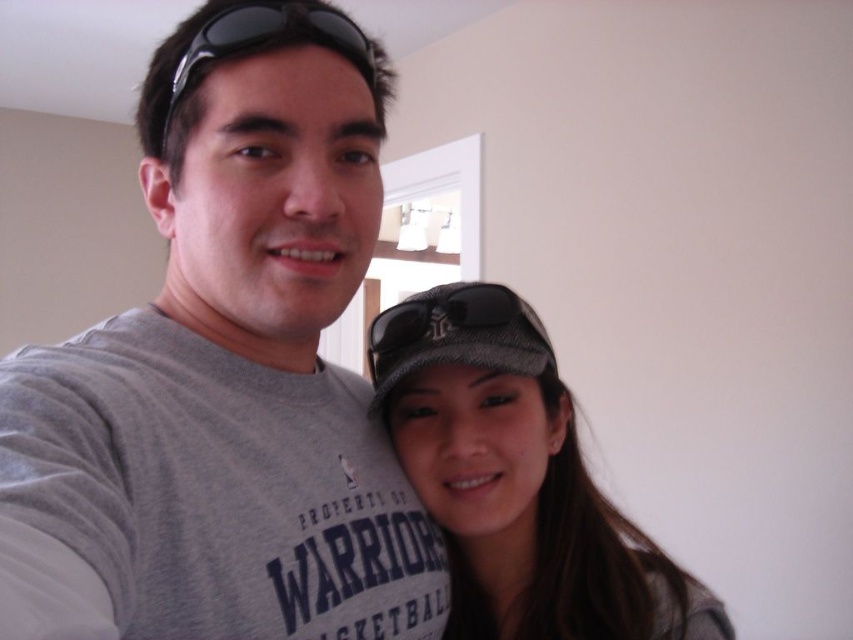
Can you confirm if gray mesh baseball cap at lower right is wider than black plastic sunglasses at upper center?

Yes, gray mesh baseball cap at lower right is wider than black plastic sunglasses at upper center.

Which is in front, point (390, 310) or point (364, 64)?

Positioned in front is point (364, 64).

Where is `gray mesh baseball cap at lower right`? gray mesh baseball cap at lower right is located at coordinates (456, 333).

Does gray matte t-shirt at center come behind gray mesh baseball cap at lower right?

No.

Is gray matte t-shirt at center below gray mesh baseball cap at lower right?

Incorrect, gray matte t-shirt at center is not positioned below gray mesh baseball cap at lower right.

The image size is (853, 640). Find the location of `gray matte t-shirt at center`. gray matte t-shirt at center is located at coordinates (225, 376).

Where is `gray matte t-shirt at center`? gray matte t-shirt at center is located at coordinates (225, 376).

Does gray matte t-shirt at center appear on the right side of textured gray cap at center?

Incorrect, gray matte t-shirt at center is not on the right side of textured gray cap at center.

At what (x,y) coordinates should I click in order to perform the action: click on gray matte t-shirt at center. Please return your answer as a coordinate pair (x, y). Looking at the image, I should click on (225, 376).

Identify the location of gray matte t-shirt at center. The image size is (853, 640). (225, 376).